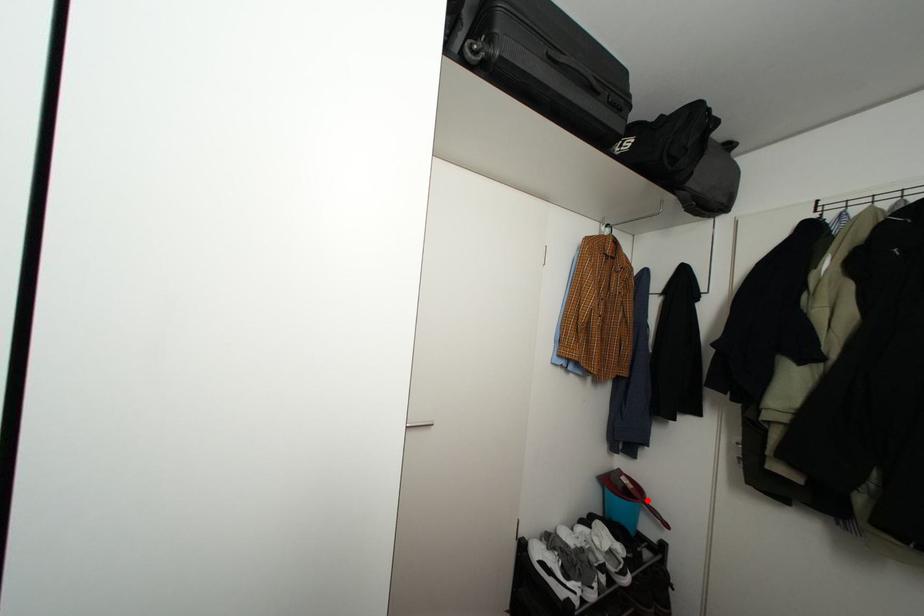
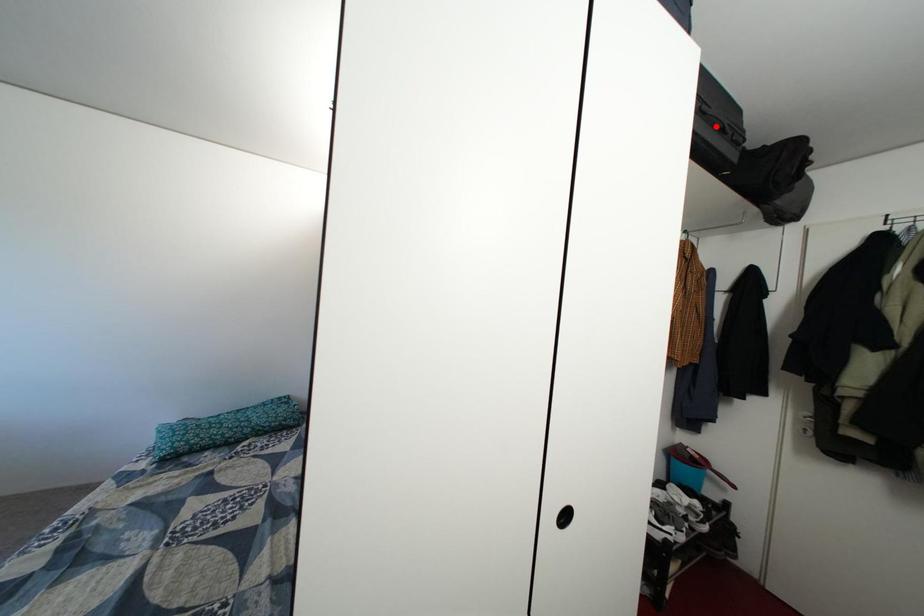
I am providing you with two images of the same scene from different viewpoints. A red point is marked on the first image and another point is marked on the second image. Is the marked point in image1 the same physical position as the marked point in image2?

No